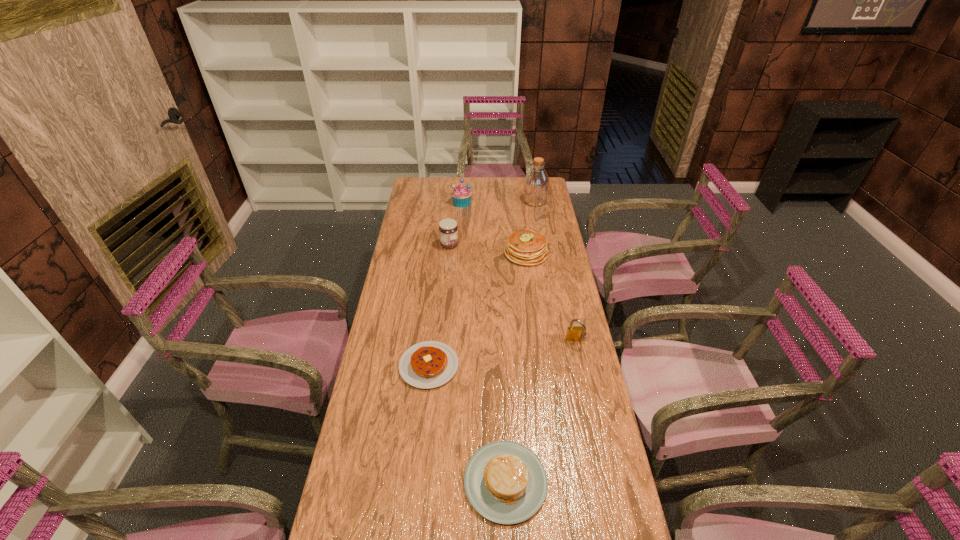
Locate an element on the screen. bottle is located at coordinates (536, 184).

The height and width of the screenshot is (540, 960). I want to click on muffin, so click(x=461, y=195).

The image size is (960, 540). Identify the location of jam. (448, 230).

Find the location of a particular element. The image size is (960, 540). padlock is located at coordinates (574, 334).

The width and height of the screenshot is (960, 540). Identify the location of the fifth tallest object. (525, 247).

Find the location of a particular element. The image size is (960, 540). the farthest pancake is located at coordinates (525, 247).

At what (x,y) coordinates should I click in order to perform the action: click on the nearest object. Please return your answer as a coordinate pair (x, y). This screenshot has width=960, height=540. Looking at the image, I should click on (505, 482).

Image resolution: width=960 pixels, height=540 pixels. Find the location of `the sixth tallest object`. the sixth tallest object is located at coordinates (505, 482).

You are a GUI agent. You are given a task and a screenshot of the screen. Output one action in this format:
    pyautogui.click(x=<x>, y=<y>)
    Task: Click on the second farthest pancake
    The width and height of the screenshot is (960, 540).
    Given the screenshot: What is the action you would take?
    pyautogui.click(x=429, y=364)

The width and height of the screenshot is (960, 540). What are the coordinates of `the shortest object` in the screenshot? It's located at (429, 364).